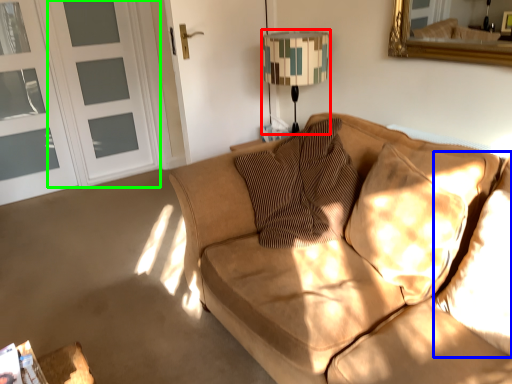
Question: Estimate the real-world distances between objects in this image. Which object is closer to table lamp (highlighted by a red box), pillow (highlighted by a blue box) or screen door (highlighted by a green box)?

Choices:
 (A) pillow
 (B) screen door

Answer: (A)